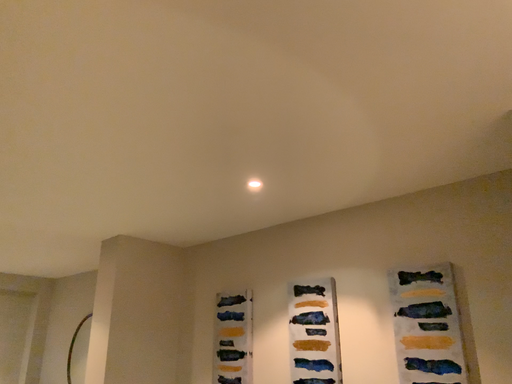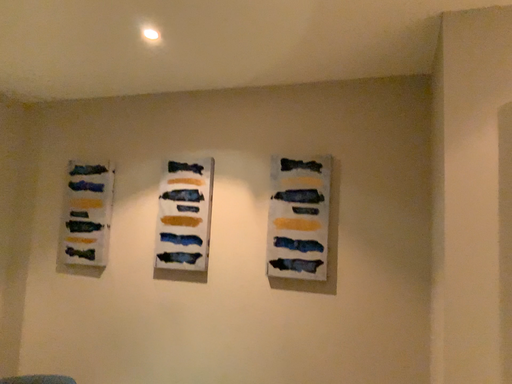
Question: How did the camera likely rotate when shooting the video?

Choices:
 (A) rotated upward
 (B) rotated downward

Answer: (B)